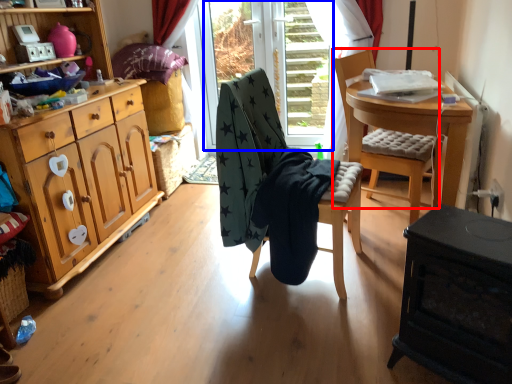
Question: Which point is closer to the camera, chair (highlighted by a red box) or glass door (highlighted by a blue box)?

Choices:
 (A) chair
 (B) glass door

Answer: (A)